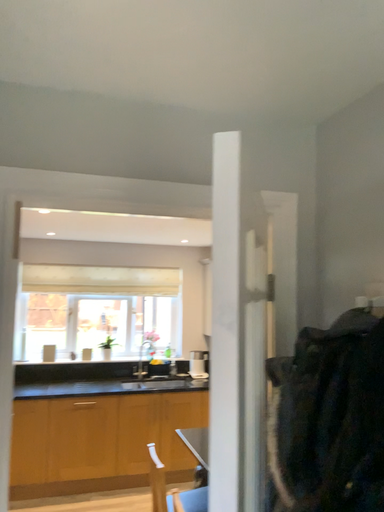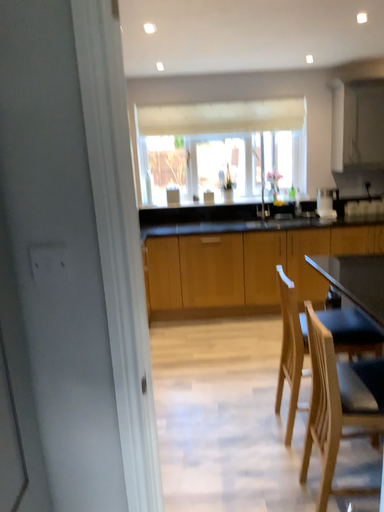
Question: Which way did the camera rotate in the video?

Choices:
 (A) rotated upward
 (B) rotated downward

Answer: (B)